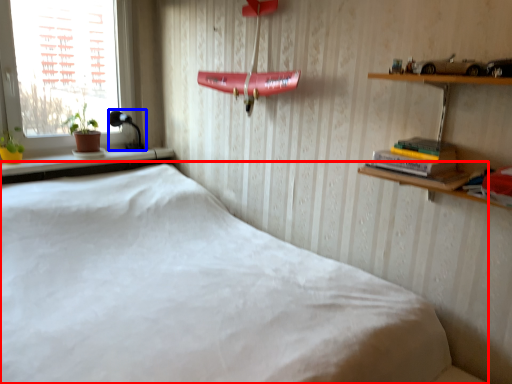
Question: Among these objects, which one is farthest to the camera, bed (highlighted by a red box) or lamp (highlighted by a blue box)?

Choices:
 (A) bed
 (B) lamp

Answer: (B)